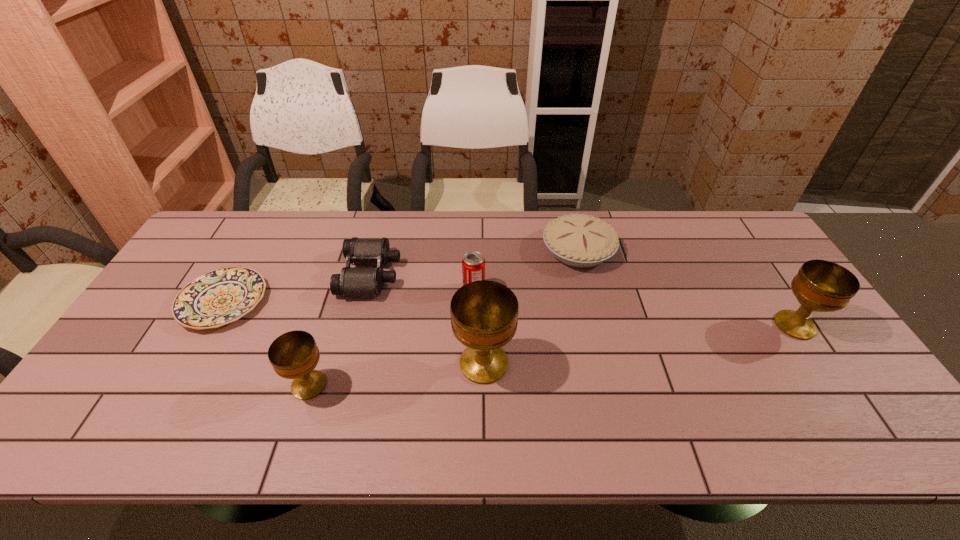
Where is `the leftmost chalice`? This screenshot has height=540, width=960. the leftmost chalice is located at coordinates (294, 355).

The height and width of the screenshot is (540, 960). Find the location of `the third tallest object`. the third tallest object is located at coordinates (294, 355).

Find the location of `the tallest chalice`. the tallest chalice is located at coordinates (484, 313).

Image resolution: width=960 pixels, height=540 pixels. In order to click on the second chalice from right to left in this screenshot , I will do `click(484, 313)`.

At what (x,y) coordinates should I click in order to perform the action: click on the rightmost chalice. Please return your answer as a coordinate pair (x, y). The height and width of the screenshot is (540, 960). Looking at the image, I should click on (822, 286).

Locate an element on the screen. the sixth shortest object is located at coordinates (822, 286).

I want to click on the leftmost object, so click(x=221, y=296).

At what (x,y) coordinates should I click in order to perform the action: click on the shortest object. Please return your answer as a coordinate pair (x, y). Looking at the image, I should click on pyautogui.click(x=221, y=296).

The image size is (960, 540). Identify the location of binoculars. (352, 281).

The width and height of the screenshot is (960, 540). In order to click on pie in this screenshot , I will do `click(582, 241)`.